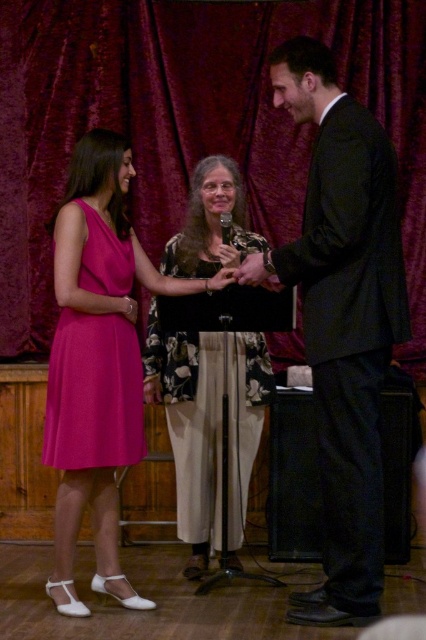
You are an event photographer who needs to capture a clear photo of the matte pink dress at left and the velvet dark red curtain at upper center. However, the curtain is partially blocking your view. Can you adjust your position to ensure both objects are fully visible in the frame?

The matte pink dress at left is behind the velvet dark red curtain at upper center. To capture both fully, move to a position where the dress is not obscured by the curtain, perhaps by moving to the side or adjusting the angle so the curtain and dress are in separate areas of the frame.